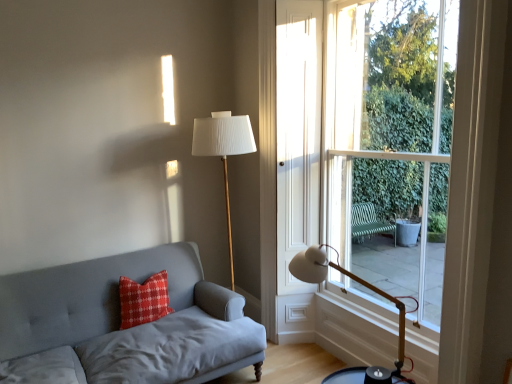
What do you see at coordinates (224, 150) in the screenshot?
I see `white pleated fabric lampshade at center, marked as the first table lamp in a left-to-right arrangement` at bounding box center [224, 150].

Measure the distance between white matte table lamp at lower right, which ranks as the 1th table lamp in front-to-back order, and camera.

The distance of white matte table lamp at lower right, which ranks as the 1th table lamp in front-to-back order, from camera is 2.02 meters.

The image size is (512, 384). Find the location of `red textured pillow at left`. red textured pillow at left is located at coordinates (143, 300).

Identify the location of clear glass window at right. The width and height of the screenshot is (512, 384). point(372,142).

How different are the orientations of clear glass window at right and matte gray fabric couch at left in degrees?

There is a 90.3-degree angle between the facing directions of clear glass window at right and matte gray fabric couch at left.

Is matte gray fabric couch at left located within clear glass window at right?

Definitely not — matte gray fabric couch at left is not inside clear glass window at right.

Is clear glass window at right in front of or behind matte gray fabric couch at left in the image?

Visually, clear glass window at right is located behind matte gray fabric couch at left.

Could you tell me if clear glass window at right is facing matte gray fabric couch at left?

Yes.

Is point (221, 130) closer or farther from the camera than point (292, 259)?

Point (221, 130) is closer to the camera than point (292, 259).

Could you tell me if white pleated fabric lampshade at center, the 2th table lamp from the right, is turned towards white matte table lamp at lower right, which ranks as the 1th table lamp in front-to-back order?

Yes, white pleated fabric lampshade at center, the 2th table lamp from the right, is oriented towards white matte table lamp at lower right, which ranks as the 1th table lamp in front-to-back order.

Which of these two, white pleated fabric lampshade at center, which is the first table lamp from back to front, or white matte table lamp at lower right, acting as the second table lamp starting from the left, stands shorter?

Standing shorter between the two is white matte table lamp at lower right, acting as the second table lamp starting from the left.

From the image's perspective, is white pleated fabric lampshade at center, marked as the first table lamp in a left-to-right arrangement, over white matte table lamp at lower right, acting as the second table lamp starting from the left?

Yes, from the image's perspective, white pleated fabric lampshade at center, marked as the first table lamp in a left-to-right arrangement, is on top of white matte table lamp at lower right, acting as the second table lamp starting from the left.

Is matte gray fabric couch at left aimed at red textured pillow at left?

Yes.

In terms of height, does matte gray fabric couch at left look taller or shorter compared to red textured pillow at left?

Clearly, matte gray fabric couch at left is taller compared to red textured pillow at left.

From a real-world perspective, is matte gray fabric couch at left located higher than clear glass window at right?

No.

Locate an element on the screen. This screenshot has width=512, height=384. window that appears above the matte gray fabric couch at left (from the image's perspective) is located at coordinates (372, 142).

Considering the sizes of objects matte gray fabric couch at left and clear glass window at right in the image provided, who is thinner, matte gray fabric couch at left or clear glass window at right?

clear glass window at right is thinner.

From the image's perspective, does matte gray fabric couch at left appear lower than clear glass window at right?

Indeed, from the image's perspective, matte gray fabric couch at left is shown beneath clear glass window at right.

Which point is more distant from viewer, (283, 260) or (230, 138)?

Point (283, 260)

The image size is (512, 384). I want to click on window above the white pleated fabric lampshade at center, marked as the first table lamp in a left-to-right arrangement (from the image's perspective), so 372,142.

Considering the relative sizes of clear glass window at right and white pleated fabric lampshade at center, the 2th table lamp from the right, in the image provided, is clear glass window at right taller than white pleated fabric lampshade at center, the 2th table lamp from the right,?

Yes, clear glass window at right is taller than white pleated fabric lampshade at center, the 2th table lamp from the right.

Can we say clear glass window at right lies outside white pleated fabric lampshade at center, which is the first table lamp from back to front?

clear glass window at right lies outside white pleated fabric lampshade at center, which is the first table lamp from back to front,'s area.

Is red textured pillow at left far away from white matte table lamp at lower right, acting as the second table lamp starting from the left?

Yes, red textured pillow at left and white matte table lamp at lower right, acting as the second table lamp starting from the left, are located far from each other.

Is red textured pillow at left looking in the opposite direction of white matte table lamp at lower right, acting as the second table lamp starting from the left?

No, red textured pillow at left is not facing the opposite direction of white matte table lamp at lower right, acting as the second table lamp starting from the left.

Between red textured pillow at left and white matte table lamp at lower right, acting as the second table lamp starting from the left, which one appears on the left side from the viewer's perspective?

From the viewer's perspective, red textured pillow at left appears more on the left side.

Image resolution: width=512 pixels, height=384 pixels. In order to click on pillow below the white matte table lamp at lower right, positioned as the second table lamp in back-to-front order (from a real-world perspective) in this screenshot , I will do `click(143, 300)`.

Is white matte table lamp at lower right, positioned as the second table lamp in back-to-front order, located within matte gray fabric couch at left?

Definitely not — white matte table lamp at lower right, positioned as the second table lamp in back-to-front order, is not inside matte gray fabric couch at left.

Does matte gray fabric couch at left have a larger size compared to white matte table lamp at lower right, acting as the second table lamp starting from the left?

Yes, matte gray fabric couch at left is bigger than white matte table lamp at lower right, acting as the second table lamp starting from the left.

Based on the photo, does matte gray fabric couch at left come in front of white matte table lamp at lower right, which is counted as the 1th table lamp, starting from the right?

No, matte gray fabric couch at left is behind white matte table lamp at lower right, which is counted as the 1th table lamp, starting from the right.

What are the coordinates of `window on the right of matte gray fabric couch at left` in the screenshot? It's located at (372, 142).

At what (x,y) coordinates should I click in order to perform the action: click on table lamp located below the white pleated fabric lampshade at center, which is the first table lamp from back to front (from the image's perspective). Please return your answer as a coordinate pair (x, y). This screenshot has height=384, width=512. Looking at the image, I should click on (361, 284).

When comparing their distances from matte gray fabric couch at left, does clear glass window at right or white pleated fabric lampshade at center, the 2th table lamp from the right, seem further?

Among the two, clear glass window at right is located further to matte gray fabric couch at left.

Looking at the image, which one is located closer to red textured pillow at left, white matte table lamp at lower right, positioned as the second table lamp in back-to-front order, or matte gray fabric couch at left?

Among the two, matte gray fabric couch at left is located nearer to red textured pillow at left.

Considering their positions, is white pleated fabric lampshade at center, which is the first table lamp from back to front, positioned closer to matte gray fabric couch at left than red textured pillow at left?

red textured pillow at left is closer to matte gray fabric couch at left.

Considering their positions, is white pleated fabric lampshade at center, which is the first table lamp from back to front, positioned closer to white matte table lamp at lower right, acting as the second table lamp starting from the left, than clear glass window at right?

Among the two, clear glass window at right is located nearer to white matte table lamp at lower right, acting as the second table lamp starting from the left.

Based on their spatial positions, is red textured pillow at left or clear glass window at right closer to white pleated fabric lampshade at center, which is the first table lamp from back to front?

Based on the image, clear glass window at right appears to be nearer to white pleated fabric lampshade at center, which is the first table lamp from back to front.

From the image, which object appears to be nearer to matte gray fabric couch at left, white matte table lamp at lower right, positioned as the second table lamp in back-to-front order, or red textured pillow at left?

Based on the image, red textured pillow at left appears to be nearer to matte gray fabric couch at left.

Considering their positions, is clear glass window at right positioned further to red textured pillow at left than white matte table lamp at lower right, positioned as the second table lamp in back-to-front order?

clear glass window at right is positioned further to the anchor red textured pillow at left.

Which object lies further to the anchor point clear glass window at right, white matte table lamp at lower right, which is counted as the 1th table lamp, starting from the right, or white pleated fabric lampshade at center, the second table lamp when ordered from front to back?

white matte table lamp at lower right, which is counted as the 1th table lamp, starting from the right, is further to clear glass window at right.

The image size is (512, 384). I want to click on table lamp located between red textured pillow at left and white matte table lamp at lower right, which is counted as the 1th table lamp, starting from the right, in the left-right direction, so click(x=224, y=150).

The height and width of the screenshot is (384, 512). Identify the location of pillow situated between matte gray fabric couch at left and white matte table lamp at lower right, acting as the second table lamp starting from the left, from left to right. (143, 300).

The image size is (512, 384). I want to click on table lamp between matte gray fabric couch at left and white matte table lamp at lower right, which is counted as the 1th table lamp, starting from the right, from left to right, so click(x=224, y=150).

The height and width of the screenshot is (384, 512). I want to click on window positioned between white matte table lamp at lower right, which ranks as the 1th table lamp in front-to-back order, and white pleated fabric lampshade at center, the second table lamp when ordered from front to back, from near to far, so click(372, 142).